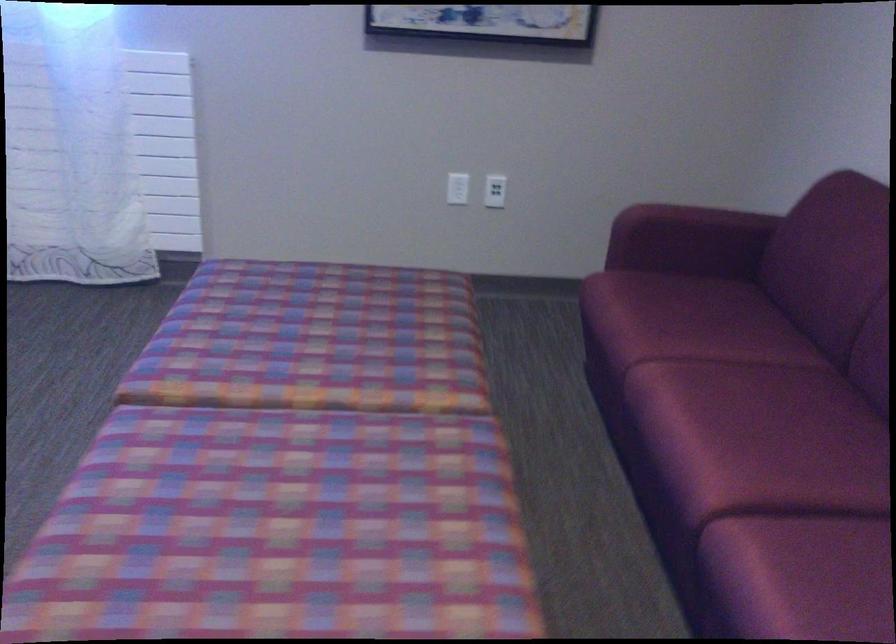
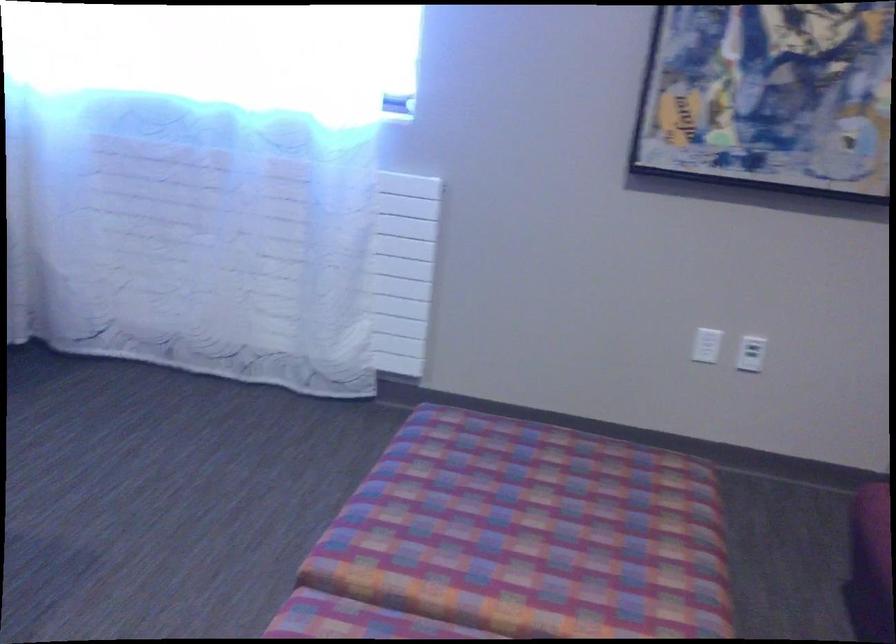
Where in the second image is the point corresponding to point 458,185 from the first image?

(707, 345)